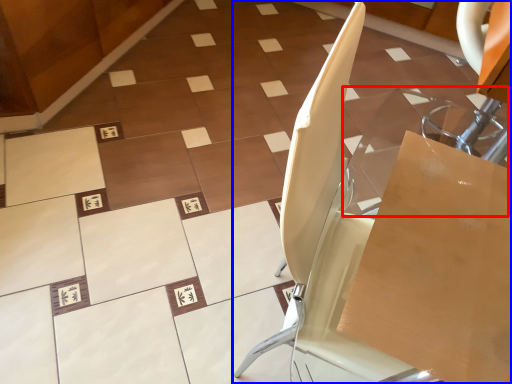
Question: Which object appears closest to the camera in this image, glass table (highlighted by a red box) or furniture (highlighted by a blue box)?

Choices:
 (A) glass table
 (B) furniture

Answer: (B)